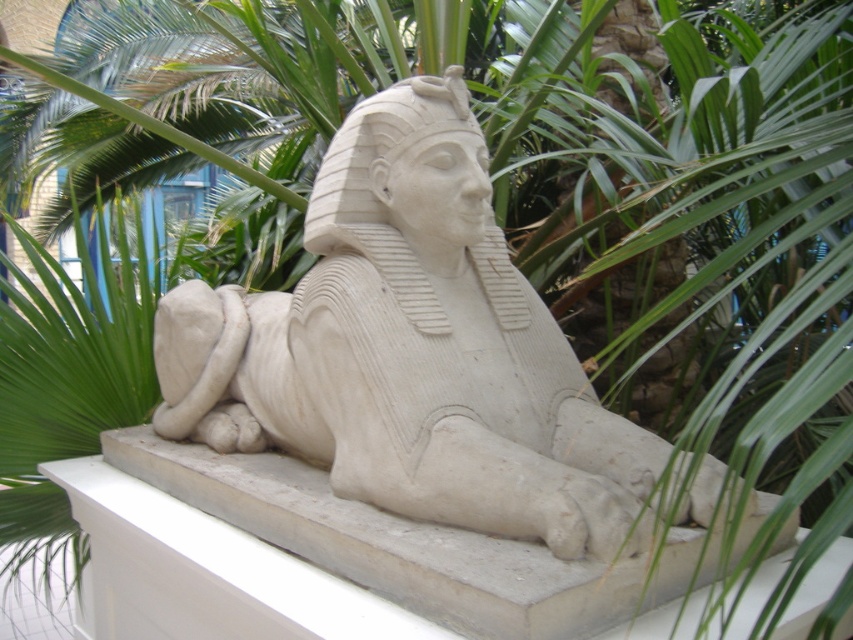
Question: Can you confirm if white stone sphinx at center is positioned below white stone ledge at center?

Choices:
 (A) yes
 (B) no

Answer: (B)

Question: Does white stone sphinx at center appear under white stone ledge at center?

Choices:
 (A) yes
 (B) no

Answer: (B)

Question: Among these objects, which one is farthest from the camera?

Choices:
 (A) white stone sphinx at center
 (B) white stone ledge at center

Answer: (A)

Question: Does white stone sphinx at center appear under white stone ledge at center?

Choices:
 (A) no
 (B) yes

Answer: (A)